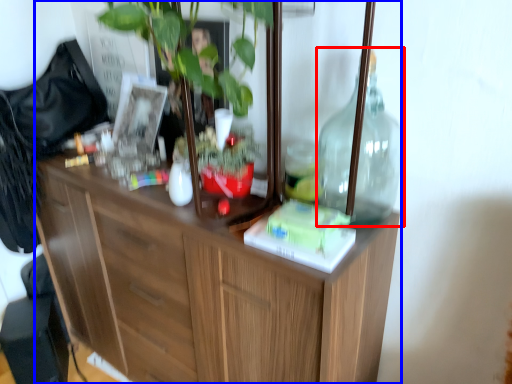
Question: Which object is closer to the camera taking this photo, bottle (highlighted by a red box) or cabinetry (highlighted by a blue box)?

Choices:
 (A) bottle
 (B) cabinetry

Answer: (B)